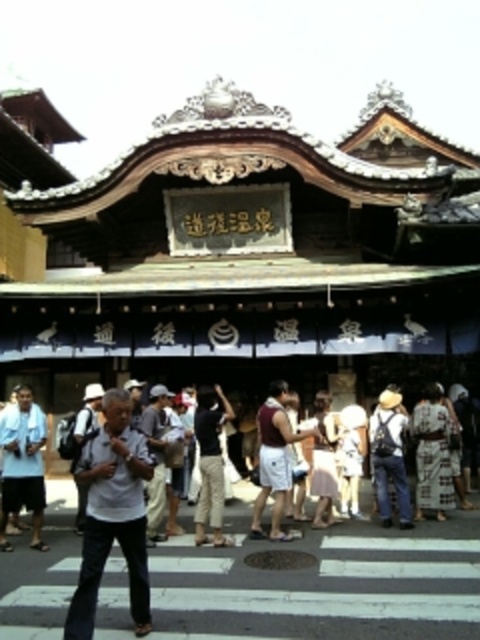
You are a photographer trying to capture the group of people in front of the traditional Japanese building. You notice the dark gray cotton pants at center and the pink fabric dress at center. Which clothing item is located to the left of the other?

The dark gray cotton pants at center is positioned on the left side of pink fabric dress at center.

You are a photographer planning to capture a group photo of the people in front of the traditional Japanese building. The white cotton kimono at center and the pink fabric dress at center are the focal points. Since you want to ensure both are clearly visible, which clothing item should you focus on to avoid blurring due to size differences?

The white cotton kimono at center is smaller than the pink fabric dress at center. To ensure both are clearly visible, focus on the white cotton kimono at center since it is smaller and might require closer attention to capture details without blurring.

You are a photographer standing in front of the traditional Japanese building. You see a white cotton kimono at center and a pink fabric dress at center. Which clothing item is located to the right of the other?

The white cotton kimono at center is positioned on the right side of pink fabric dress at center.